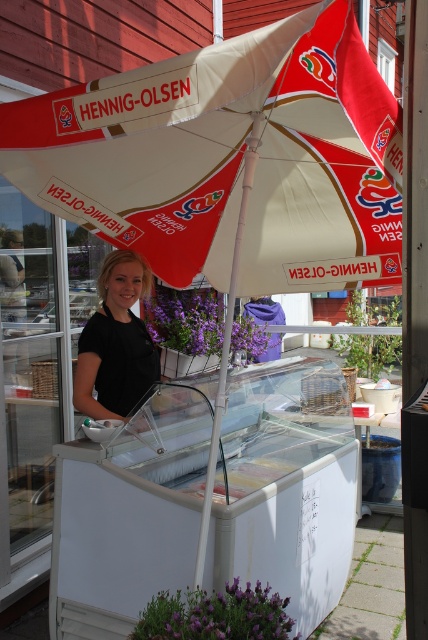
You are a customer at the Hennig Olsen ice cream stand. You want to take a photo of the stand with your phone. Where should you position yourself to ensure the white fabric umbrella at center is in the center of your photo?

Position yourself directly in front of the white fabric umbrella at center, aligned with its central point at coordinates approximately 0.248 on the x axis and 0.535 on the y axis to center it in your photo.